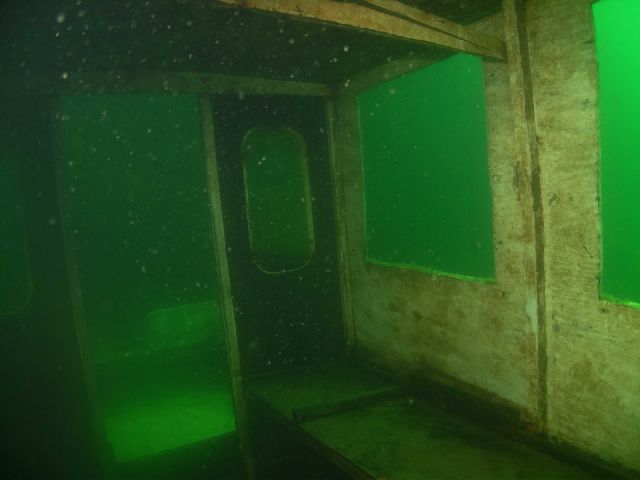
Locate an element on the screen. The height and width of the screenshot is (480, 640). sitting area is located at coordinates coord(283,396), coord(368,435).